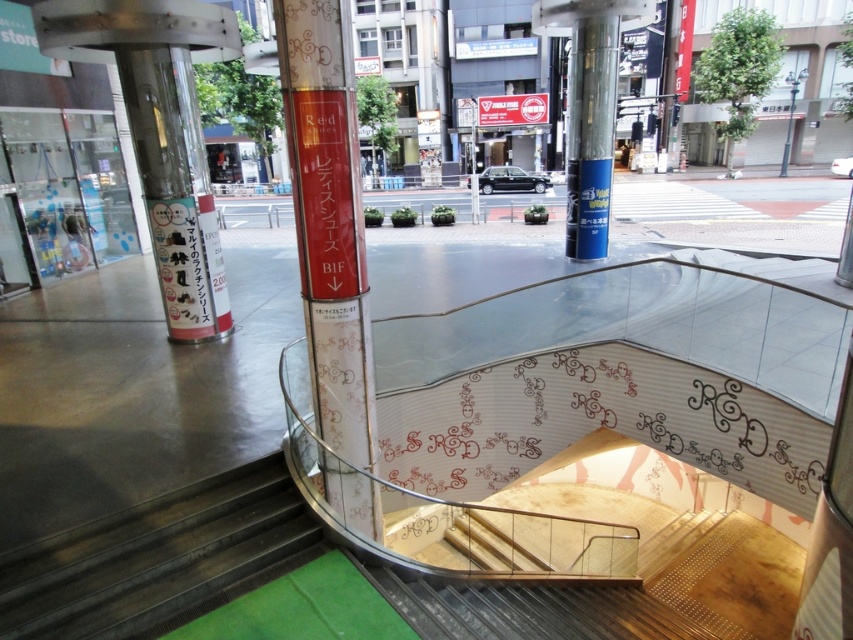
Question: From the image, what is the correct spatial relationship of blue glossy pillar at center in relation to black metal pole at upper right?

Choices:
 (A) above
 (B) below

Answer: (B)

Question: Which of the following is the closest to the observer?

Choices:
 (A) (183, 216)
 (B) (610, 131)
 (C) (780, 172)
 (D) (345, 76)

Answer: (D)

Question: Is metallic silver pillar at left positioned behind black metal pole at upper right?

Choices:
 (A) no
 (B) yes

Answer: (A)

Question: Which point appears farthest from the camera in this image?

Choices:
 (A) (328, 227)
 (B) (105, 33)

Answer: (B)

Question: Is matte pink column at center thinner than black metal pole at upper right?

Choices:
 (A) yes
 (B) no

Answer: (B)

Question: Which of the following is the farthest from the observer?

Choices:
 (A) black metal pole at upper right
 (B) metallic silver pillar at left

Answer: (A)